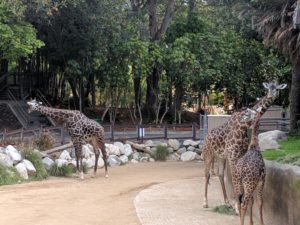
Locate an element on the screen. This screenshot has height=225, width=300. wall is located at coordinates (215, 124).